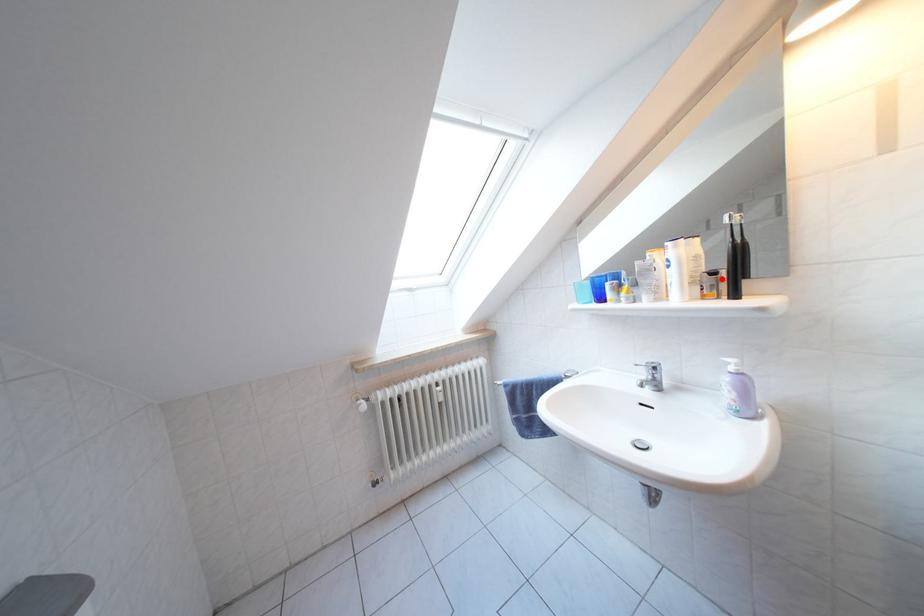
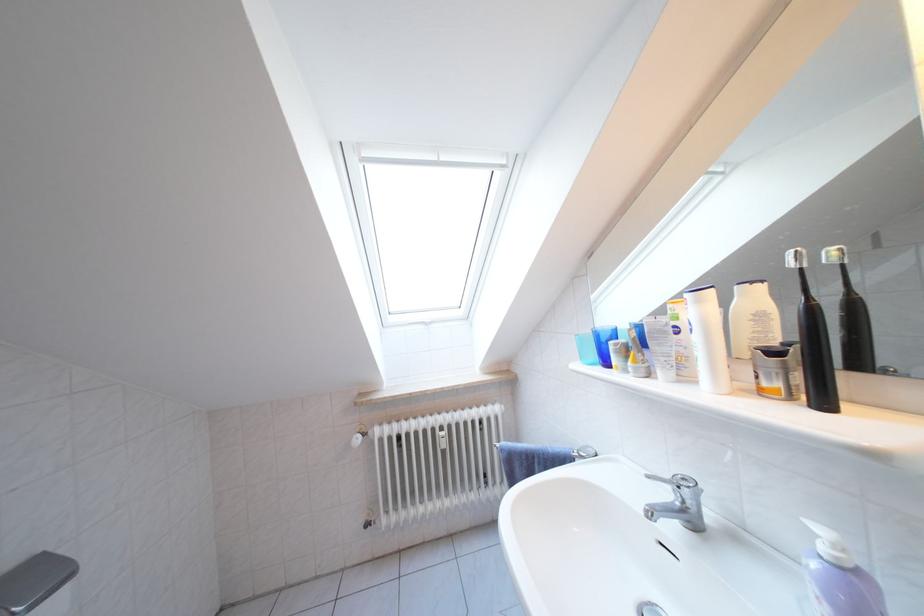
Question: I am providing you with two images of the same scene from different viewpoints. A red point is marked on the first image. Can you still see the location of the red point in image 2?

Choices:
 (A) Yes
 (B) No

Answer: (A)